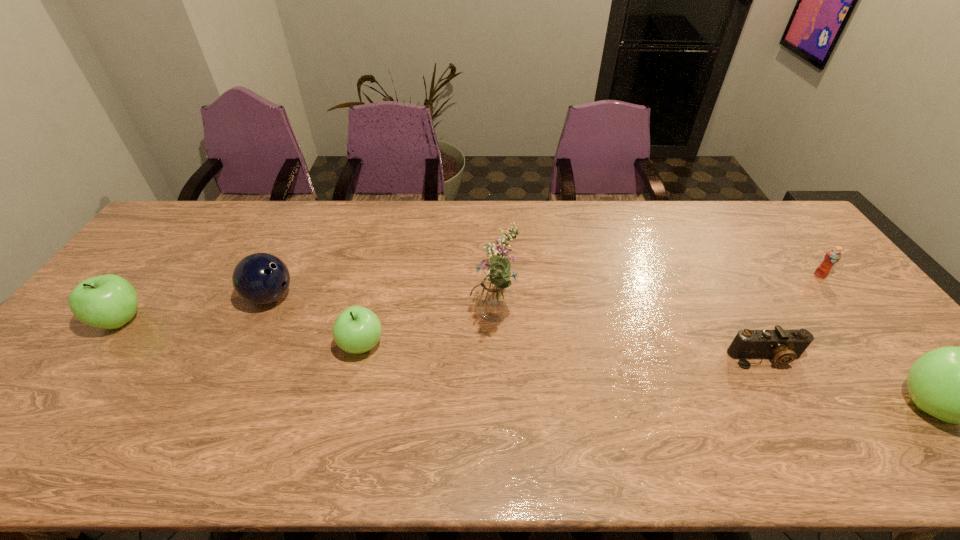
At what (x,y) coordinates should I click in order to perform the action: click on the second shortest apple. Please return your answer as a coordinate pair (x, y). Looking at the image, I should click on pyautogui.click(x=109, y=301).

Locate an element on the screen. the leftmost apple is located at coordinates (109, 301).

Identify the location of the shortest apple. (357, 329).

Image resolution: width=960 pixels, height=540 pixels. I want to click on the second apple from left to right, so click(357, 329).

Identify the location of the farthest object. (833, 256).

At what (x,y) coordinates should I click in order to perform the action: click on bouquet. Please return your answer as a coordinate pair (x, y). The image size is (960, 540). Looking at the image, I should click on [x=493, y=298].

Find the location of `the tallest object`. the tallest object is located at coordinates (493, 298).

You are a GUI agent. You are given a task and a screenshot of the screen. Output one action in this format:
    pyautogui.click(x=<x>, y=<y>)
    Task: Click on the third object from right to left
    The image size is (960, 540).
    Given the screenshot: What is the action you would take?
    pyautogui.click(x=784, y=346)

Locate an element on the screen. camera is located at coordinates (784, 346).

Locate an element on the screen. the sixth object from right to left is located at coordinates (261, 278).